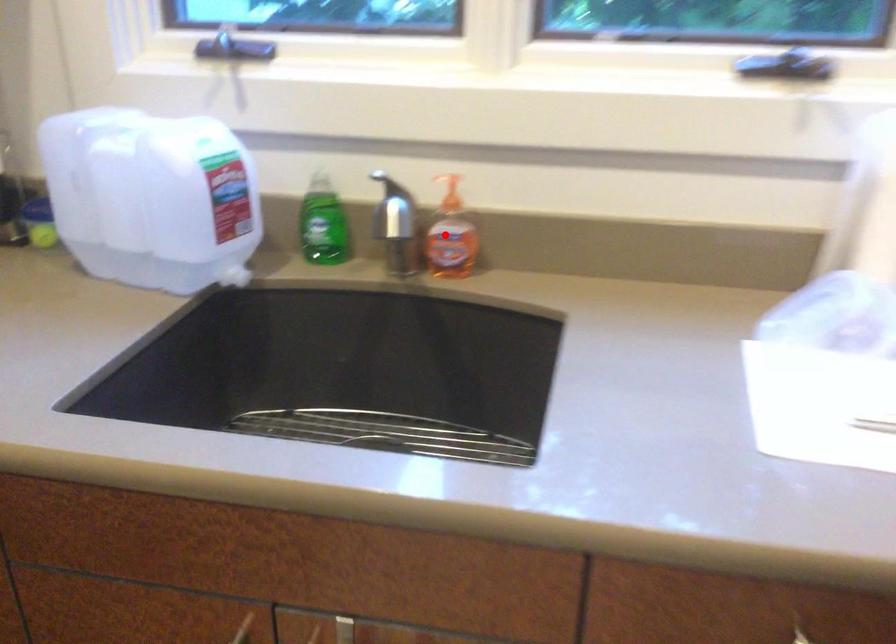
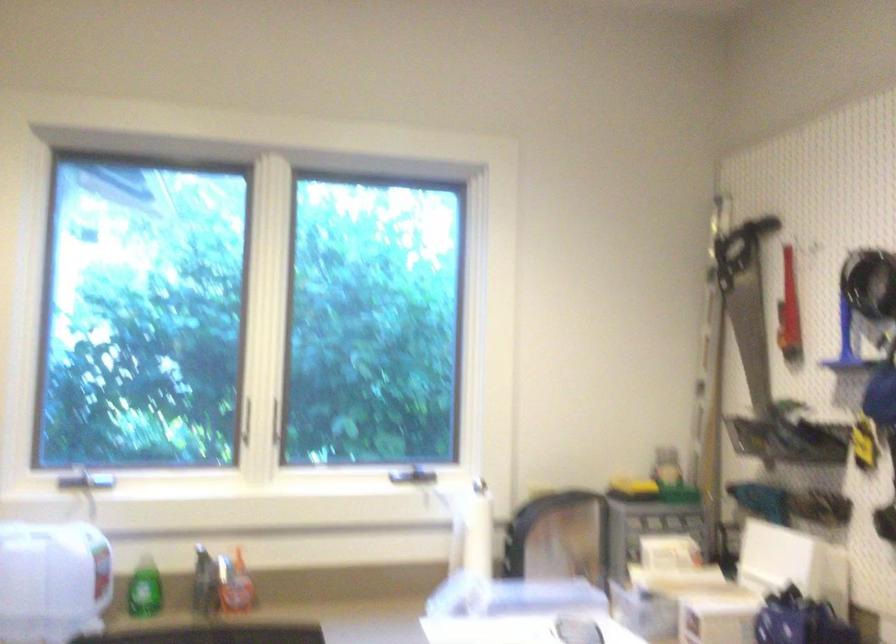
Find the pixel in the second image that matches the highlighted location in the first image.

(234, 583)